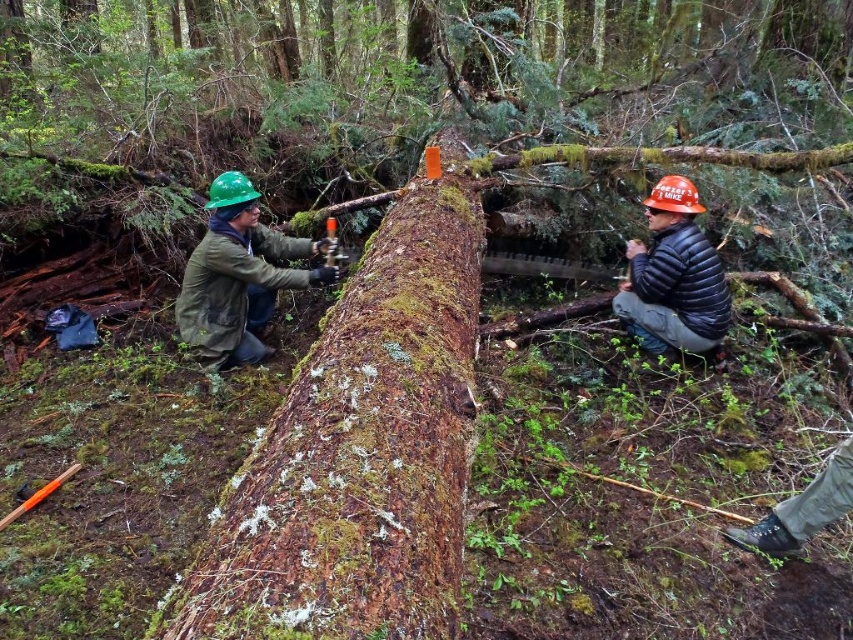
You are a safety inspector in the forest and need to check the distance between the green matte helmet at left and the orange hard hat at right. Which worker is closer to you, the inspector, as you approach the fallen tree trunk?

The green matte helmet at left is closer to you than the orange hard hat at right because it is positioned further to the viewer, meaning it is nearer in your line of sight.